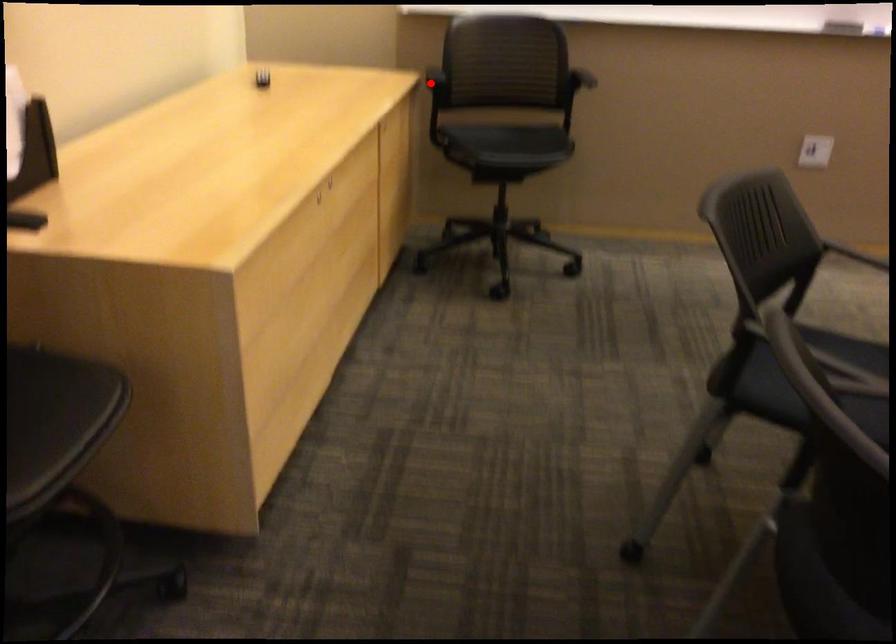
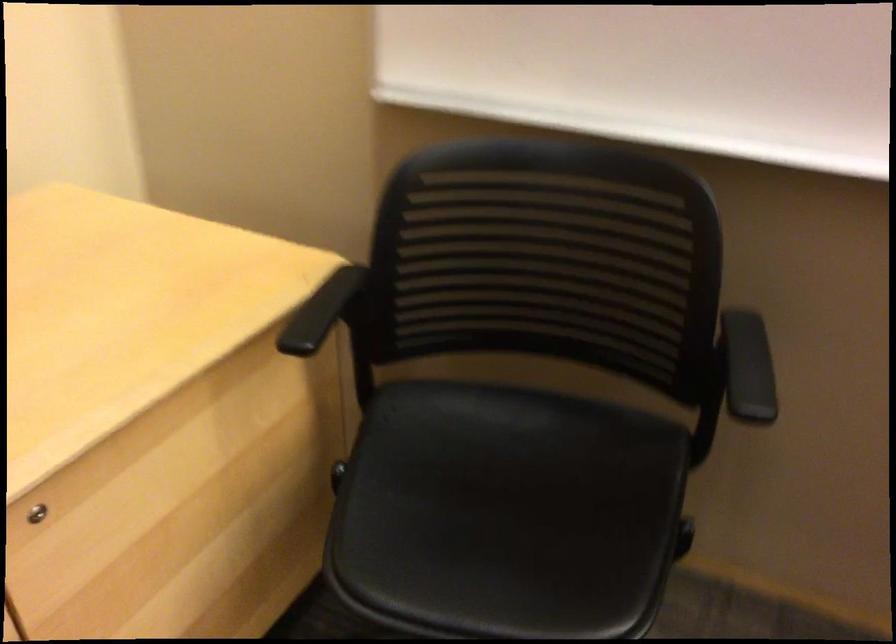
Find the pixel in the second image that matches the highlighted location in the first image.

(322, 310)